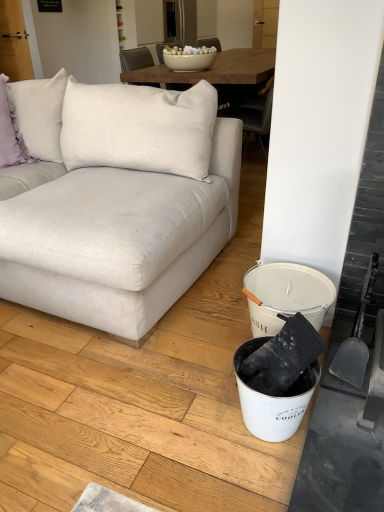
This screenshot has height=512, width=384. What do you see at coordinates (273, 398) in the screenshot?
I see `white matte bucket at lower right` at bounding box center [273, 398].

Find the location of a particular element. white matte bucket at lower right is located at coordinates (273, 398).

Locate an element on the screen. Image resolution: width=384 pixels, height=512 pixels. bucket below the white fabric couch at left (from the image's perspective) is located at coordinates (273, 398).

From the image's perspective, between white matte bucket at lower right and white fabric couch at left, who is located below?

white matte bucket at lower right is shown below in the image.

Considering the relative sizes of white matte bucket at lower right and white fabric couch at left in the image provided, is white matte bucket at lower right shorter than white fabric couch at left?

Indeed, white matte bucket at lower right has a lesser height compared to white fabric couch at left.

Is white matte bucket at lower right bigger than white fabric couch at left?

Actually, white matte bucket at lower right might be smaller than white fabric couch at left.

How far apart are white fabric couch at left and gray plastic shovel at right?

The distance of white fabric couch at left from gray plastic shovel at right is 3.32 feet.

Considering their positions, is white fabric couch at left located in front of or behind gray plastic shovel at right?

white fabric couch at left is in front of gray plastic shovel at right.

From the image's perspective, which one is positioned lower, white fabric couch at left or gray plastic shovel at right?

gray plastic shovel at right.

Who is shorter, white fabric couch at left or gray plastic shovel at right?

Standing shorter between the two is gray plastic shovel at right.

Which of these two, white fabric couch at left or white matte bucket at lower right, stands shorter?

With less height is white matte bucket at lower right.

Where is `bucket below the white fabric couch at left (from the image's perspective)`? Image resolution: width=384 pixels, height=512 pixels. bucket below the white fabric couch at left (from the image's perspective) is located at coordinates (273, 398).

From a real-world perspective, is white fabric couch at left below white matte bucket at lower right?

Incorrect, from a real-world perspective, white fabric couch at left is higher than white matte bucket at lower right.

Looking at this image, is white fabric couch at left next to white matte bucket at lower right and touching it?

They are not placed beside each other.

Between point (7, 151) and point (204, 163), which one is positioned in front?

The point (204, 163) is closer to the camera.

Which object is further away from the camera taking this photo, lavender fabric pillow at upper left or white fabric couch at left?

lavender fabric pillow at upper left is more distant.

Could you tell me if lavender fabric pillow at upper left is turned towards white fabric couch at left?

Yes, lavender fabric pillow at upper left is turned towards white fabric couch at left.

From the image's perspective, is white matte bucket at lower right positioned above or below lavender fabric pillow at upper left?

white matte bucket at lower right is situated lower than lavender fabric pillow at upper left in the image.

Is point (258, 412) positioned before point (0, 138)?

Yes.

Considering the sizes of objects white matte bucket at lower right and lavender fabric pillow at upper left in the image provided, who is taller, white matte bucket at lower right or lavender fabric pillow at upper left?

lavender fabric pillow at upper left.

What's the angular difference between white fabric couch at left and lavender fabric pillow at upper left's facing directions?

The angle between the facing direction of white fabric couch at left and the facing direction of lavender fabric pillow at upper left is 56.1 degrees.

Consider the image. Considering the relative sizes of white fabric couch at left and lavender fabric pillow at upper left in the image provided, is white fabric couch at left bigger than lavender fabric pillow at upper left?

Correct, white fabric couch at left is larger in size than lavender fabric pillow at upper left.

Find the location of a particular element. The width and height of the screenshot is (384, 512). studio couch on the right of lavender fabric pillow at upper left is located at coordinates (121, 206).

Considering the positions of objects white fabric couch at left and lavender fabric pillow at upper left in the image provided, who is in front, white fabric couch at left or lavender fabric pillow at upper left?

white fabric couch at left is more forward.

From a real-world perspective, is gray plastic shovel at right on top of white fabric couch at left?

No.

Is gray plastic shovel at right facing away from white fabric couch at left?

No, gray plastic shovel at right's orientation is not away from white fabric couch at left.

Where is `bucket that is under the white fabric couch at left (from a real-world perspective)`? Image resolution: width=384 pixels, height=512 pixels. bucket that is under the white fabric couch at left (from a real-world perspective) is located at coordinates (273, 398).

Image resolution: width=384 pixels, height=512 pixels. I want to click on shovel behind the white fabric couch at left, so click(x=356, y=336).

Consider the image. Looking at the image, which one is located further to white matte bucket at lower right, white fabric couch at left or lavender fabric pillow at upper left?

lavender fabric pillow at upper left.

Looking at the image, which one is located further to white matte bucket at lower right, gray plastic shovel at right or white fabric couch at left?

white fabric couch at left.

From the picture: From the image, which object appears to be nearer to white fabric couch at left, lavender fabric pillow at upper left or gray plastic shovel at right?

Among the two, lavender fabric pillow at upper left is located nearer to white fabric couch at left.

When comparing their distances from lavender fabric pillow at upper left, does gray plastic shovel at right or white matte bucket at lower right seem further?

gray plastic shovel at right.

Based on their spatial positions, is gray plastic shovel at right or white fabric couch at left closer to lavender fabric pillow at upper left?

white fabric couch at left is positioned closer to the anchor lavender fabric pillow at upper left.

Looking at the image, which one is located closer to lavender fabric pillow at upper left, white matte bucket at lower right or gray plastic shovel at right?

Among the two, white matte bucket at lower right is located nearer to lavender fabric pillow at upper left.

From the image, which object appears to be farther from white matte bucket at lower right, lavender fabric pillow at upper left or gray plastic shovel at right?

lavender fabric pillow at upper left lies further to white matte bucket at lower right than the other object.

Estimate the real-world distances between objects in this image. Which object is further from gray plastic shovel at right, white matte bucket at lower right or lavender fabric pillow at upper left?

Based on the image, lavender fabric pillow at upper left appears to be further to gray plastic shovel at right.

Locate an element on the screen. studio couch between lavender fabric pillow at upper left and white matte bucket at lower right is located at coordinates (121, 206).

The image size is (384, 512). What are the coordinates of `studio couch between lavender fabric pillow at upper left and gray plastic shovel at right` in the screenshot? It's located at (121, 206).

In order to click on bucket between lavender fabric pillow at upper left and gray plastic shovel at right in this screenshot , I will do `click(273, 398)`.

This screenshot has height=512, width=384. In order to click on bucket between white fabric couch at left and gray plastic shovel at right from left to right in this screenshot , I will do `click(273, 398)`.